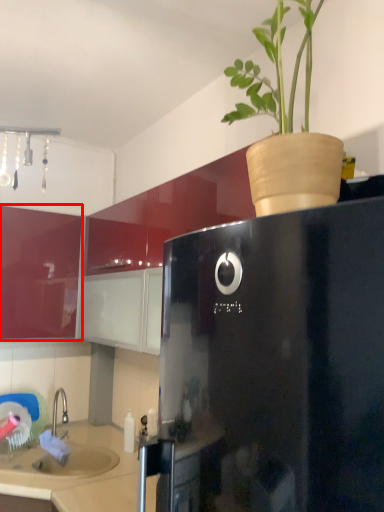
Question: From the image, what is the correct spatial relationship of cabinetry (annotated by the red box) in relation to counter top?

Choices:
 (A) right
 (B) left

Answer: (B)